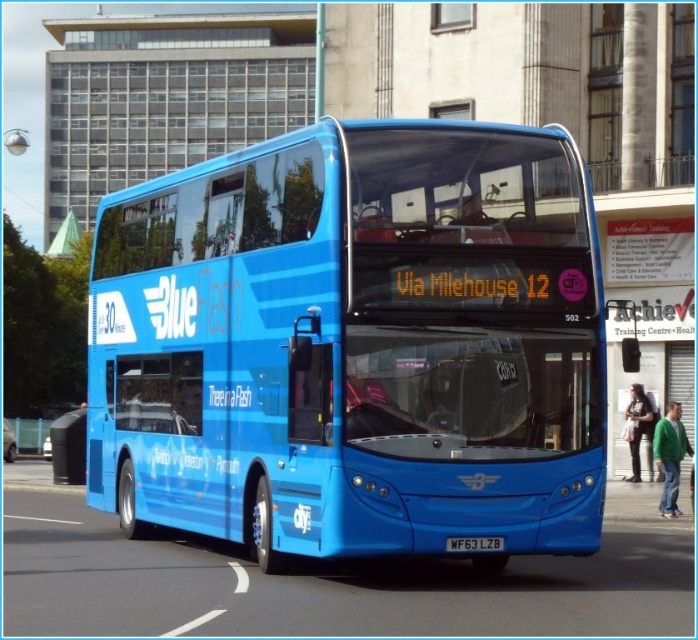
You are a city planner analyzing traffic flow. The blue glossy bus at center is at coordinates 0.539 on the x and 0.509 on the y. If the road is represented on a grid from 0 to 1 in both axes, where would you expect the white lane marking to be in relation to the bus?

The white lane marking is likely positioned below the blue glossy bus at center since the bus is at coordinates (355, 344), which places it centrally on the grid. Typically, lane markings run along the sides of the road, so they would be lower on the y or x axis depending on road orientation.

What are the coordinates of the blue glossy bus at center?

The coordinates of the blue glossy bus at center are at point (355,344).

You are a delivery person who needs to place a small package on the white plastic license plate at center. The matte black trash can at lower left is in the way. Can you place the package on the license plate without moving the trash can?

The matte black trash can at lower left is much taller than the white plastic license plate at center. Since the trash can is taller, it might block the line of sight or access to the license plate, making it difficult to place the package without moving the trash can.